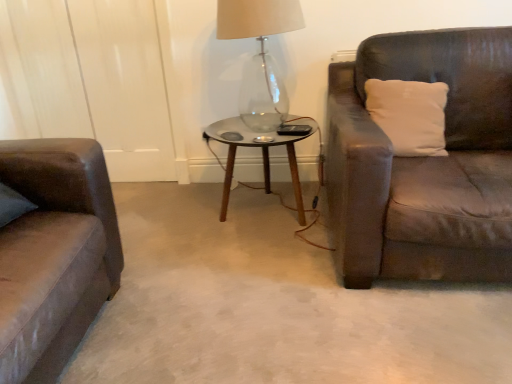
Question: Can you confirm if transparent glass table lamp at center is positioned to the right of white soft pillow at right?

Choices:
 (A) yes
 (B) no

Answer: (B)

Question: Is transparent glass table lamp at center behind white soft pillow at right?

Choices:
 (A) no
 (B) yes

Answer: (B)

Question: Is white soft pillow at right at the back of transparent glass table lamp at center?

Choices:
 (A) no
 (B) yes

Answer: (A)

Question: Considering the relative positions of transparent glass table lamp at center and white soft pillow at right in the image provided, is transparent glass table lamp at center to the left of white soft pillow at right from the viewer's perspective?

Choices:
 (A) yes
 (B) no

Answer: (A)

Question: Does transparent glass table lamp at center lie in front of white soft pillow at right?

Choices:
 (A) yes
 (B) no

Answer: (B)

Question: From a real-world perspective, relative to transparent glass coffee table at center, is white soft pillow at right vertically above or below?

Choices:
 (A) above
 (B) below

Answer: (A)

Question: Is point (399, 96) closer or farther from the camera than point (226, 140)?

Choices:
 (A) closer
 (B) farther

Answer: (A)

Question: From the image's perspective, is white soft pillow at right located above or below transparent glass coffee table at center?

Choices:
 (A) above
 (B) below

Answer: (A)

Question: Looking at their shapes, would you say white soft pillow at right is wider or thinner than transparent glass coffee table at center?

Choices:
 (A) thin
 (B) wide

Answer: (A)

Question: From the image's perspective, is transparent glass table lamp at center located above or below white soft pillow at right?

Choices:
 (A) above
 (B) below

Answer: (A)

Question: Considering the positions of point (280, 23) and point (369, 102), is point (280, 23) closer or farther from the camera than point (369, 102)?

Choices:
 (A) closer
 (B) farther

Answer: (A)

Question: In the image, is transparent glass table lamp at center positioned in front of or behind white soft pillow at right?

Choices:
 (A) behind
 (B) front

Answer: (A)

Question: From a real-world perspective, is transparent glass table lamp at center positioned above or below white soft pillow at right?

Choices:
 (A) below
 (B) above

Answer: (B)

Question: Is transparent glass coffee table at center to the left or to the right of white soft pillow at right in the image?

Choices:
 (A) left
 (B) right

Answer: (A)

Question: Is transparent glass coffee table at center inside the boundaries of white soft pillow at right, or outside?

Choices:
 (A) outside
 (B) inside

Answer: (A)